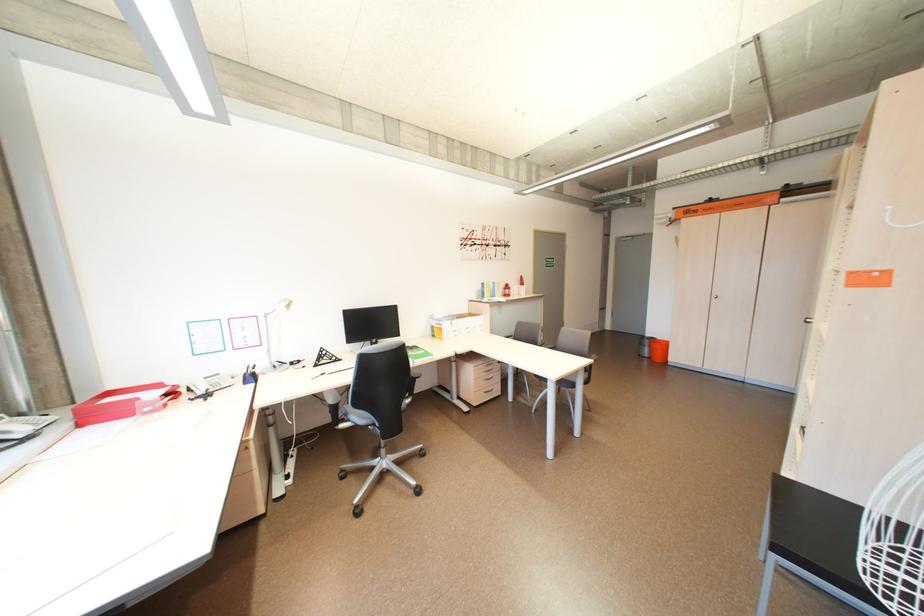
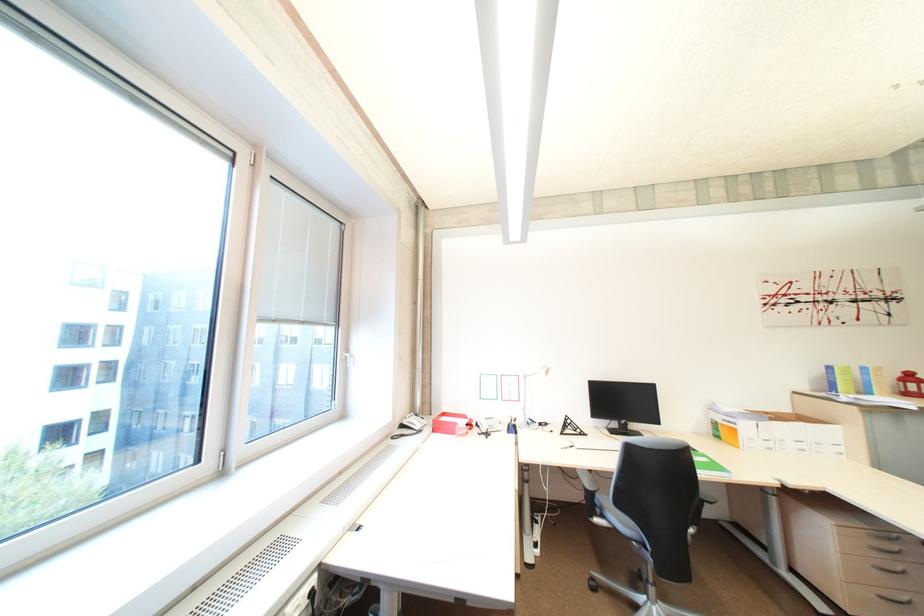
In the second image, find the point that corresponds to point 341,402 in the first image.

(598, 485)